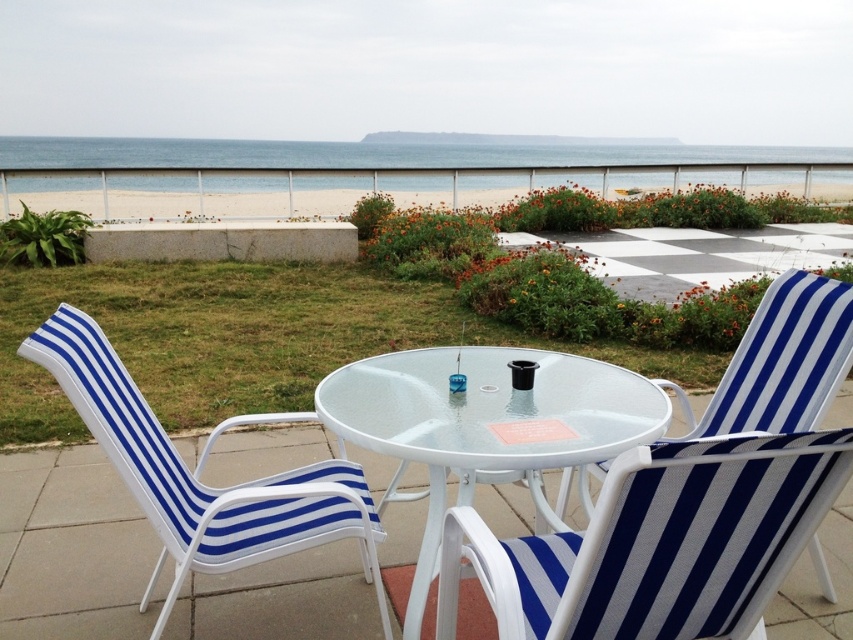
Question: Which is nearer to the white sand at upper center?

Choices:
 (A) transparent glass table at center
 (B) blue striped fabric beach chair at left

Answer: (A)

Question: Which point is closer to the camera?

Choices:
 (A) (422, 422)
 (B) (146, 586)
 (C) (735, 531)
 (D) (563, 211)

Answer: (C)

Question: Which is farther from the blue striped fabric beach chair at left?

Choices:
 (A) white sand at upper center
 (B) blue striped fabric beach chair at center
 (C) blue striped fabric chair at center
 (D) transparent glass table at center

Answer: (A)

Question: Is blue striped fabric chair at center below white sand at upper center?

Choices:
 (A) no
 (B) yes

Answer: (B)

Question: Does blue striped fabric beach chair at center come behind blue striped fabric chair at center?

Choices:
 (A) yes
 (B) no

Answer: (B)

Question: Does blue striped fabric beach chair at center have a lesser width compared to blue striped fabric chair at center?

Choices:
 (A) no
 (B) yes

Answer: (A)